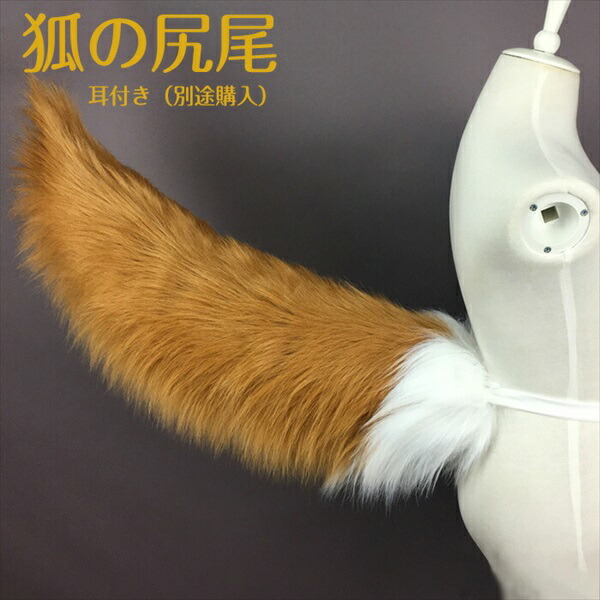
Where is `white thin pieces of fabric`? This screenshot has width=600, height=600. white thin pieces of fabric is located at coordinates (565, 408), (573, 357).